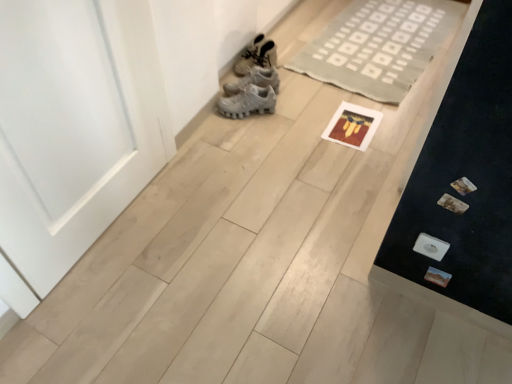
This screenshot has width=512, height=384. In order to click on free space in front of neutral woven rug at upper center in this screenshot , I will do `click(325, 140)`.